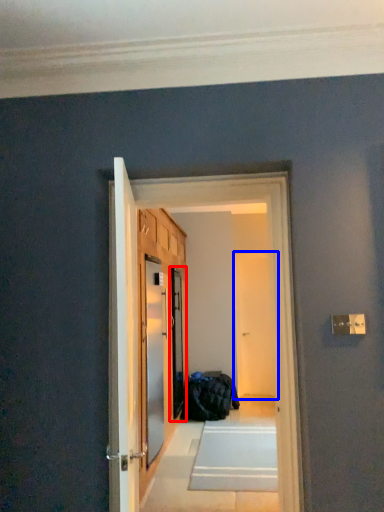
Question: Which object is further to the camera taking this photo, screen door (highlighted by a red box) or screen door (highlighted by a blue box)?

Choices:
 (A) screen door
 (B) screen door

Answer: (B)